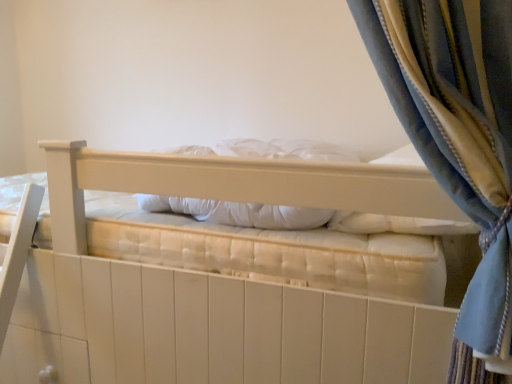
Question: Relative to white soft pillow at center, is white quilted mattress at center in front or behind?

Choices:
 (A) front
 (B) behind

Answer: (A)

Question: Is white quilted mattress at center wider or thinner than white soft pillow at center?

Choices:
 (A) thin
 (B) wide

Answer: (B)

Question: From the image's perspective, is white quilted mattress at center positioned above or below white soft pillow at center?

Choices:
 (A) above
 (B) below

Answer: (B)

Question: Is white soft pillow at center spatially inside white quilted mattress at center, or outside of it?

Choices:
 (A) outside
 (B) inside

Answer: (B)

Question: In the image, is white soft pillow at center positioned in front of or behind white quilted mattress at center?

Choices:
 (A) front
 (B) behind

Answer: (B)

Question: Looking at their shapes, would you say white soft pillow at center is wider or thinner than white quilted mattress at center?

Choices:
 (A) thin
 (B) wide

Answer: (A)

Question: In terms of size, does white soft pillow at center appear bigger or smaller than white quilted mattress at center?

Choices:
 (A) big
 (B) small

Answer: (B)